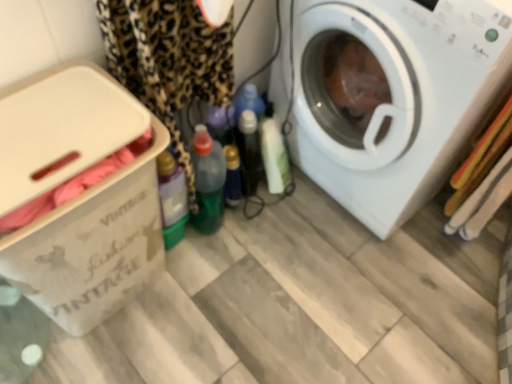
Question: Considering the relative sizes of beige cardboard box at left and white plastic washing machine at right in the image provided, is beige cardboard box at left bigger than white plastic washing machine at right?

Choices:
 (A) yes
 (B) no

Answer: (B)

Question: Does beige cardboard box at left have a smaller size compared to white plastic washing machine at right?

Choices:
 (A) yes
 (B) no

Answer: (A)

Question: From a real-world perspective, is beige cardboard box at left physically above white plastic washing machine at right?

Choices:
 (A) no
 (B) yes

Answer: (A)

Question: Is beige cardboard box at left facing towards white plastic washing machine at right?

Choices:
 (A) yes
 (B) no

Answer: (B)

Question: From the image's perspective, would you say beige cardboard box at left is shown under white plastic washing machine at right?

Choices:
 (A) yes
 (B) no

Answer: (A)

Question: Based on their positions, is green plastic bottle at center, which is the 1th bottle from left to right, located to the left or right of beige cardboard box at left?

Choices:
 (A) right
 (B) left

Answer: (A)

Question: Considering the positions of point (195, 158) and point (108, 140), is point (195, 158) closer or farther from the camera than point (108, 140)?

Choices:
 (A) closer
 (B) farther

Answer: (B)

Question: Considering the positions of green plastic bottle at center, which is the 1th bottle from left to right, and beige cardboard box at left in the image, is green plastic bottle at center, which is the 1th bottle from left to right, wider or thinner than beige cardboard box at left?

Choices:
 (A) wide
 (B) thin

Answer: (B)

Question: From their relative heights in the image, would you say green plastic bottle at center, placed as the 2th bottle when sorted from right to left, is taller or shorter than beige cardboard box at left?

Choices:
 (A) short
 (B) tall

Answer: (A)

Question: Looking at their shapes, would you say white plastic washing machine at right is wider or thinner than translucent plastic bottle at center, the 1th bottle positioned from the right?

Choices:
 (A) wide
 (B) thin

Answer: (A)

Question: Is point click(x=437, y=69) closer or farther from the camera than point click(x=233, y=200)?

Choices:
 (A) farther
 (B) closer

Answer: (B)

Question: From a real-world perspective, is white plastic washing machine at right physically located above or below translucent plastic bottle at center, the 2th bottle positioned from the left?

Choices:
 (A) below
 (B) above

Answer: (B)

Question: From their relative heights in the image, would you say white plastic washing machine at right is taller or shorter than translucent plastic bottle at center, the 1th bottle positioned from the right?

Choices:
 (A) short
 (B) tall

Answer: (B)

Question: From the image's perspective, is white plastic washing machine at right above or below leopard print fabric at left?

Choices:
 (A) below
 (B) above

Answer: (B)

Question: Based on their sizes in the image, would you say white plastic washing machine at right is bigger or smaller than leopard print fabric at left?

Choices:
 (A) big
 (B) small

Answer: (A)